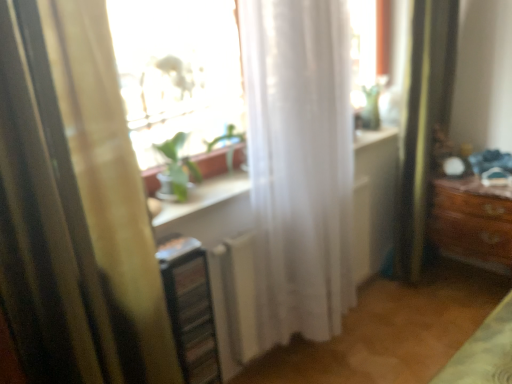
Question: Is white sheer curtain at center, placed as the second curtain when sorted from left to right, closer to the viewer compared to green fabric shower curtain at right?

Choices:
 (A) no
 (B) yes

Answer: (B)

Question: From the image's perspective, does white sheer curtain at center, placed as the second curtain when sorted from left to right, appear lower than green fabric shower curtain at right?

Choices:
 (A) yes
 (B) no

Answer: (A)

Question: Is white sheer curtain at center, positioned as the 1th curtain in right-to-left order, not near green fabric shower curtain at right?

Choices:
 (A) no
 (B) yes

Answer: (A)

Question: Is white sheer curtain at center, positioned as the 1th curtain in right-to-left order, at the right side of green fabric shower curtain at right?

Choices:
 (A) yes
 (B) no

Answer: (B)

Question: From a real-world perspective, is white sheer curtain at center, positioned as the 1th curtain in right-to-left order, located higher than green fabric shower curtain at right?

Choices:
 (A) yes
 (B) no

Answer: (A)

Question: Does point (429, 23) appear closer or farther from the camera than point (199, 276)?

Choices:
 (A) farther
 (B) closer

Answer: (A)

Question: From their relative heights in the image, would you say green fabric shower curtain at right is taller or shorter than metallic silver shelf at lower left?

Choices:
 (A) tall
 (B) short

Answer: (A)

Question: From a real-world perspective, is green fabric shower curtain at right above or below metallic silver shelf at lower left?

Choices:
 (A) below
 (B) above

Answer: (B)

Question: Which is correct: green fabric shower curtain at right is inside metallic silver shelf at lower left, or outside of it?

Choices:
 (A) inside
 (B) outside

Answer: (B)

Question: From a real-world perspective, relative to green fabric shower curtain at right, is white sheer curtain at center, positioned as the 1th curtain in right-to-left order, vertically above or below?

Choices:
 (A) below
 (B) above

Answer: (B)

Question: Visually, is white sheer curtain at center, placed as the second curtain when sorted from left to right, positioned to the left or to the right of green fabric shower curtain at right?

Choices:
 (A) left
 (B) right

Answer: (A)

Question: Considering the positions of white sheer curtain at center, positioned as the 1th curtain in right-to-left order, and green fabric shower curtain at right in the image, is white sheer curtain at center, positioned as the 1th curtain in right-to-left order, wider or thinner than green fabric shower curtain at right?

Choices:
 (A) wide
 (B) thin

Answer: (A)

Question: Is white sheer curtain at center, placed as the second curtain when sorted from left to right, taller or shorter than green fabric shower curtain at right?

Choices:
 (A) tall
 (B) short

Answer: (B)

Question: Would you say metallic silver shelf at lower left is to the left or to the right of yellow striped curtain at left, placed as the 2th curtain when sorted from right to left, in the picture?

Choices:
 (A) right
 (B) left

Answer: (A)

Question: Considering the positions of metallic silver shelf at lower left and yellow striped curtain at left, placed as the 2th curtain when sorted from right to left, in the image, is metallic silver shelf at lower left wider or thinner than yellow striped curtain at left, placed as the 2th curtain when sorted from right to left,?

Choices:
 (A) wide
 (B) thin

Answer: (B)